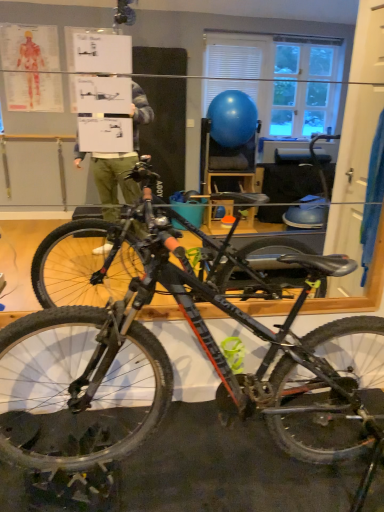
Question: Relative to shiny metallic bicycle at center, is black rubber tire at lower right in front or behind?

Choices:
 (A) front
 (B) behind

Answer: (B)

Question: From the image's perspective, is black rubber tire at lower right positioned above or below shiny metallic bicycle at center?

Choices:
 (A) above
 (B) below

Answer: (B)

Question: Do you think black rubber tire at lower right is within shiny metallic bicycle at center, or outside of it?

Choices:
 (A) outside
 (B) inside

Answer: (B)

Question: Is shiny metallic bicycle at center bigger or smaller than black rubber tire at lower right?

Choices:
 (A) small
 (B) big

Answer: (B)

Question: Visually, is shiny metallic bicycle at center positioned to the left or to the right of black rubber tire at lower right?

Choices:
 (A) left
 (B) right

Answer: (A)

Question: Is shiny metallic bicycle at center inside the boundaries of black rubber tire at lower right, or outside?

Choices:
 (A) outside
 (B) inside

Answer: (A)

Question: Considering the positions of shiny metallic bicycle at center and black rubber tire at lower right in the image, is shiny metallic bicycle at center taller or shorter than black rubber tire at lower right?

Choices:
 (A) short
 (B) tall

Answer: (B)